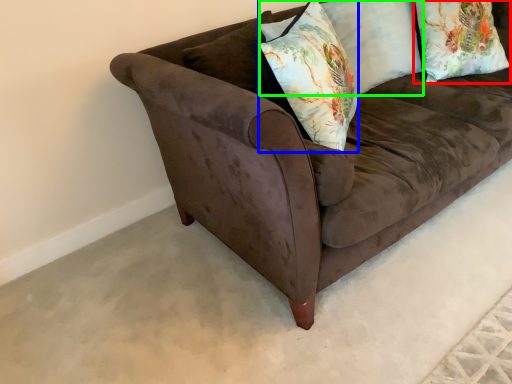
Question: Based on their relative distances, which object is farther from pillow (highlighted by a red box)? Choose from throw pillow (highlighted by a blue box) and pillow (highlighted by a green box).

Choices:
 (A) throw pillow
 (B) pillow

Answer: (A)